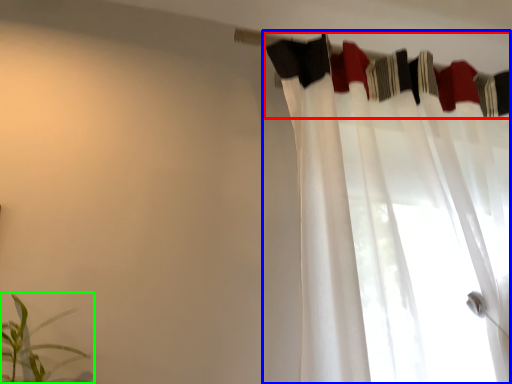
Question: Which is farther away from clothesline (highlighted by a red box)? curtain (highlighted by a blue box) or houseplant (highlighted by a green box)?

Choices:
 (A) curtain
 (B) houseplant

Answer: (B)